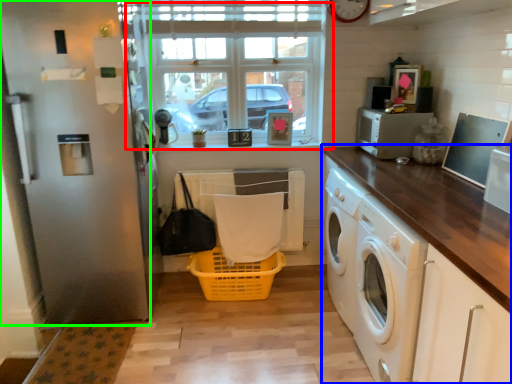
Question: Which is farther away from window (highlighted by a red box)? countertop (highlighted by a blue box) or screen door (highlighted by a green box)?

Choices:
 (A) countertop
 (B) screen door

Answer: (A)